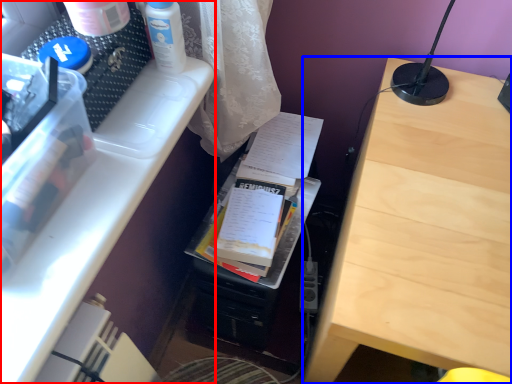
Question: Which point is closer to the camera, desk (highlighted by a red box) or table (highlighted by a blue box)?

Choices:
 (A) desk
 (B) table

Answer: (A)